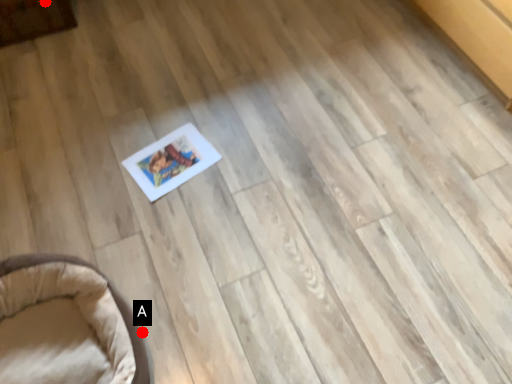
Question: Two points are circled on the image, labeled by A and B beside each circle. Which point is closer to the camera taking this photo?

Choices:
 (A) A is closer
 (B) B is closer

Answer: (A)